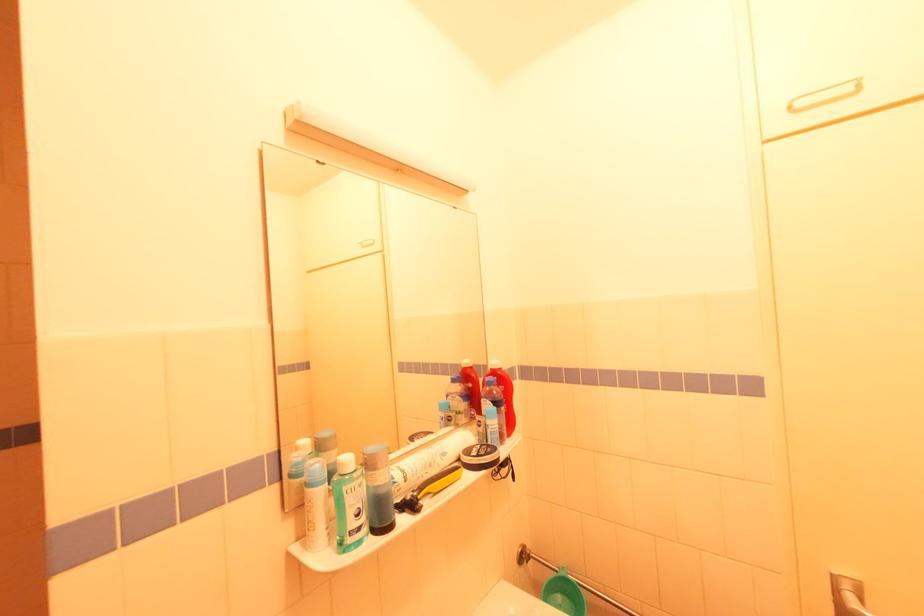
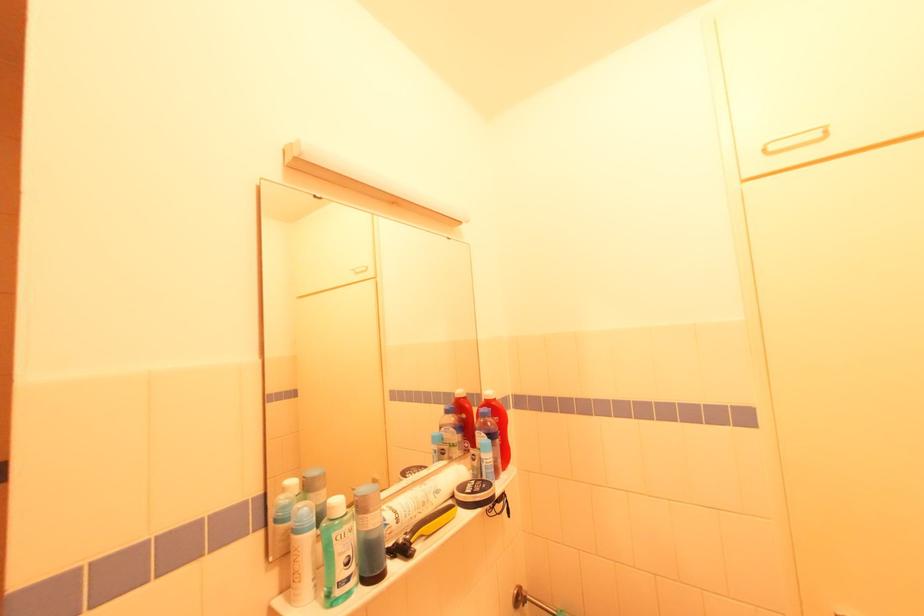
Find the pixel in the second image that matches pixel 444 459 in the first image.

(438, 496)